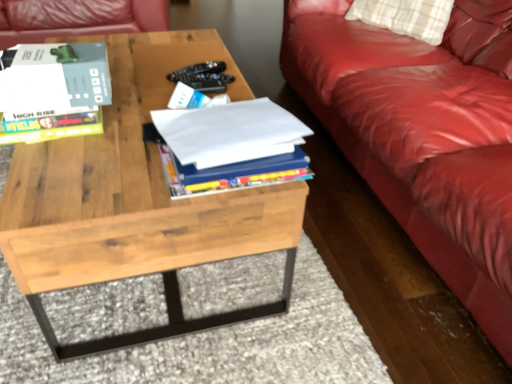
Locate an element on the screen. Image resolution: width=512 pixels, height=384 pixels. empty space that is ontop of white paper at center, marked as the 2th book in a left-to-right arrangement (from a real-world perspective) is located at coordinates (227, 135).